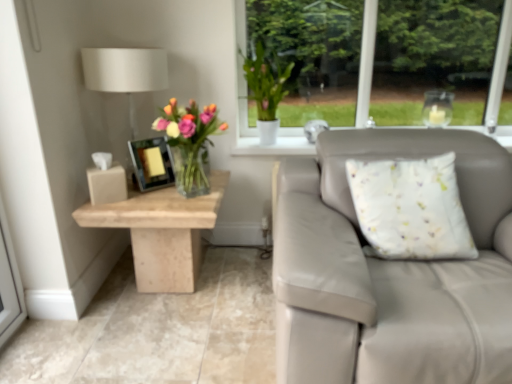
Measure the distance between point (195, 153) and camera.

Point (195, 153) and camera are 1.84 meters apart from each other.

At what (x,y) coordinates should I click in order to perform the action: click on white matte vase at upper center. Please return your answer as a coordinate pair (x, y). The width and height of the screenshot is (512, 384). Looking at the image, I should click on (265, 79).

Where is `white fabric lampshade at upper left`? The image size is (512, 384). white fabric lampshade at upper left is located at coordinates (125, 71).

What are the coordinates of `matte black picture frame at center` in the screenshot? It's located at (151, 164).

Is matte black picture frame at center positioned far away from white matte vase at upper center?

matte black picture frame at center is actually quite close to white matte vase at upper center.

From a real-world perspective, which object rests below the other?

matte black picture frame at center, from a real-world perspective.

From the image's perspective, is matte black picture frame at center positioned above or below white matte vase at upper center?

Clearly, from the image's perspective, matte black picture frame at center is below white matte vase at upper center.

How far apart are beige marble table at left and translucent glass vase at center?

A distance of 10.33 inches exists between beige marble table at left and translucent glass vase at center.

From the image's perspective, relative to translucent glass vase at center, is beige marble table at left above or below?

From the image's perspective, beige marble table at left appears below translucent glass vase at center.

Consider the image. Is beige marble table at left positioned behind translucent glass vase at center?

Yes, beige marble table at left is further from the viewer.

Considering the relative sizes of beige marble table at left and translucent glass vase at center in the image provided, is beige marble table at left smaller than translucent glass vase at center?

No, beige marble table at left is not smaller than translucent glass vase at center.

Does matte black picture frame at center have a greater width compared to translucent glass vase at center?

No.

From the image's perspective, between matte black picture frame at center and translucent glass vase at center, who is located below?

From the image's view, matte black picture frame at center is below.

Considering their positions, is matte black picture frame at center located in front of or behind translucent glass vase at center?

Clearly, matte black picture frame at center is behind translucent glass vase at center.

Between matte black picture frame at center and translucent glass vase at center, which one has more height?

translucent glass vase at center.

From a real-world perspective, who is located higher, white fabric lampshade at upper left or white fabric cushion at right?

From a 3D spatial view, white fabric lampshade at upper left is above.

Relative to white fabric cushion at right, is white fabric lampshade at upper left in front or behind?

Visually, white fabric lampshade at upper left is located behind white fabric cushion at right.

Based on the photo, does white fabric lampshade at upper left have a greater width compared to white fabric cushion at right?

Yes.

From the image's perspective, is white fabric cushion at right above or below white matte vase at upper center?

white fabric cushion at right is below white matte vase at upper center.

Is white fabric cushion at right inside or outside of white matte vase at upper center?

white fabric cushion at right is not inside white matte vase at upper center, it's outside.

How different are the orientations of white fabric cushion at right and white matte vase at upper center in degrees?

white fabric cushion at right and white matte vase at upper center are facing 11.4 degrees away from each other.

Is beige marble table at left positioned with its back to white matte vase at upper center?

beige marble table at left is not turned away from white matte vase at upper center.

Is beige marble table at left to the right of white matte vase at upper center from the viewer's perspective?

Incorrect, beige marble table at left is not on the right side of white matte vase at upper center.

Would you consider beige marble table at left to be distant from white matte vase at upper center?

That's not correct — beige marble table at left is a little close to white matte vase at upper center.

From the image's perspective, which one is positioned higher, beige marble table at left or white matte vase at upper center?

white matte vase at upper center appears higher in the image.

From a real-world perspective, which is physically above, white fabric cushion at right or matte black picture frame at center?

From a 3D spatial view, matte black picture frame at center is above.

Based on the photo, based on their sizes in the image, would you say white fabric cushion at right is bigger or smaller than matte black picture frame at center?

Clearly, white fabric cushion at right is larger in size than matte black picture frame at center.

Is white fabric cushion at right wider than matte black picture frame at center?

Indeed, white fabric cushion at right has a greater width compared to matte black picture frame at center.

This screenshot has height=384, width=512. Identify the location of picture frame that is in front of the white matte vase at upper center. (151, 164).

Where is `table on the left of translucent glass vase at center`? The height and width of the screenshot is (384, 512). table on the left of translucent glass vase at center is located at coordinates (162, 232).

Which object lies nearer to the anchor point white fabric lampshade at upper left, white matte vase at upper center or translucent glass vase at center?

translucent glass vase at center is closer to white fabric lampshade at upper left.

From the image, which object appears to be nearer to white matte vase at upper center, white fabric lampshade at upper left or beige marble table at left?

Among the two, white fabric lampshade at upper left is located nearer to white matte vase at upper center.

Based on their spatial positions, is beige marble table at left or white matte vase at upper center further from matte black picture frame at center?

white matte vase at upper center.

Looking at this image, estimate the real-world distances between objects in this image. Which object is further from beige marble table at left, matte black picture frame at center or translucent glass vase at center?

translucent glass vase at center is positioned further to the anchor beige marble table at left.

From the image, which object appears to be farther from white fabric cushion at right, matte black picture frame at center or white matte vase at upper center?

white matte vase at upper center is further to white fabric cushion at right.

When comparing their distances from white fabric lampshade at upper left, does matte black picture frame at center or beige marble table at left seem further?

beige marble table at left lies further to white fabric lampshade at upper left than the other object.

Considering their positions, is translucent glass vase at center positioned closer to matte black picture frame at center than beige marble table at left?

Based on the image, translucent glass vase at center appears to be nearer to matte black picture frame at center.

Looking at the image, which one is located closer to white matte vase at upper center, translucent glass vase at center or white fabric lampshade at upper left?

translucent glass vase at center is positioned closer to the anchor white matte vase at upper center.

The height and width of the screenshot is (384, 512). Identify the location of picture frame between translucent glass vase at center and beige marble table at left from top to bottom. (151, 164).

Where is `floral arrangement situated between matte black picture frame at center and white fabric cushion at right from left to right`? The width and height of the screenshot is (512, 384). floral arrangement situated between matte black picture frame at center and white fabric cushion at right from left to right is located at coordinates (265, 79).

Locate an element on the screen. The image size is (512, 384). picture frame between white fabric lampshade at upper left and white fabric cushion at right from left to right is located at coordinates (151, 164).

Locate an element on the screen. The image size is (512, 384). picture frame between white fabric lampshade at upper left and translucent glass vase at center from left to right is located at coordinates (151, 164).